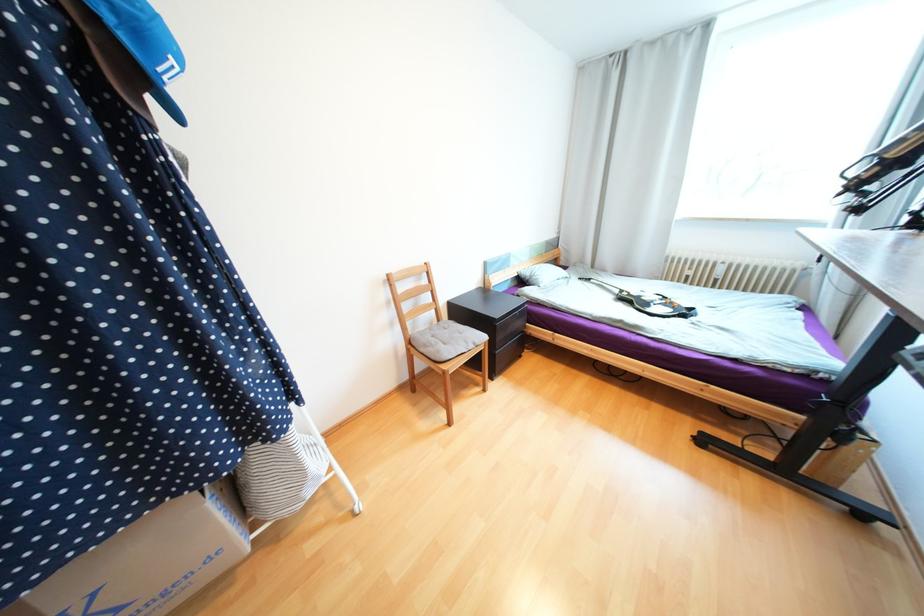
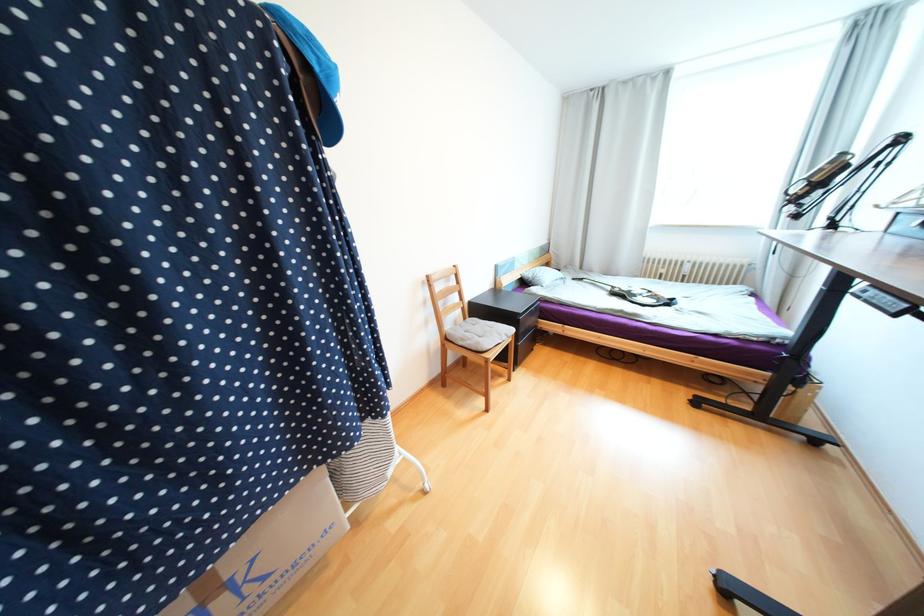
Find the pixel in the second image that matches (472,342) in the first image.

(505, 334)